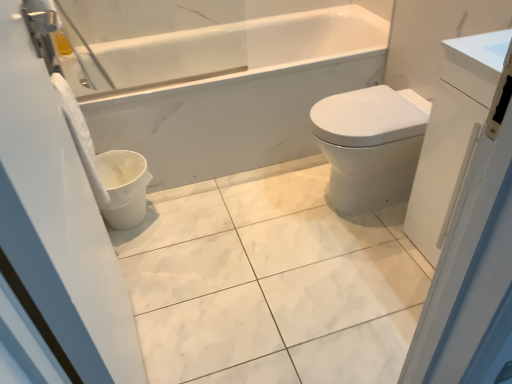
You are a GUI agent. You are given a task and a screenshot of the screen. Output one action in this format:
    pyautogui.click(x=<x>, y=<y>)
    Task: Click on the vacant space underneath white glossy screen door at left, placed as the second screen door when sorted from right to left (from a real-world perspective)
    This screenshot has height=384, width=512.
    Given the screenshot: What is the action you would take?
    pyautogui.click(x=144, y=338)